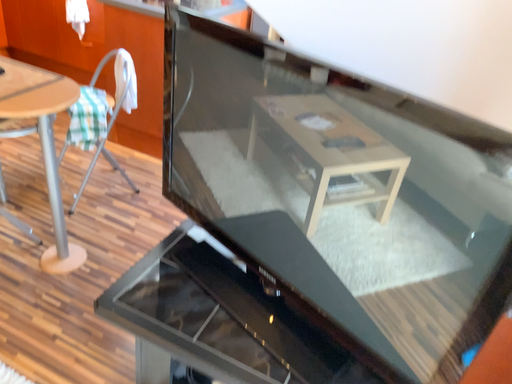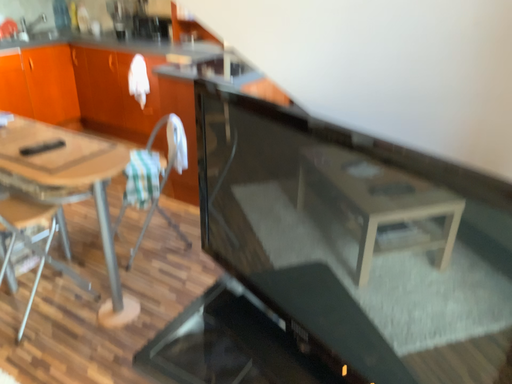
Question: Which way did the camera rotate in the video?

Choices:
 (A) rotated downward
 (B) rotated upward

Answer: (B)